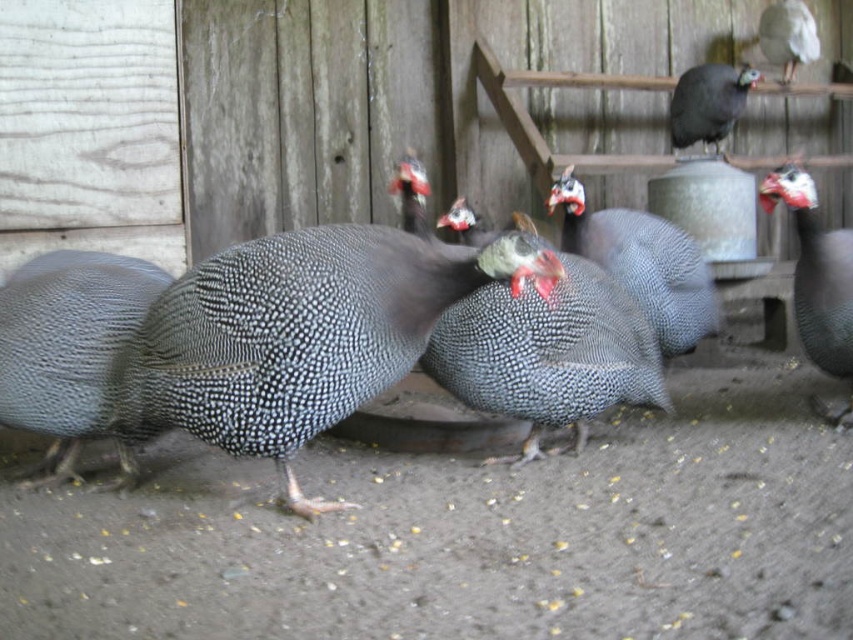
Who is positioned more to the right, speckled feathered guinea fowl at right or gray speckled guinea fowl at upper right?

From the viewer's perspective, gray speckled guinea fowl at upper right appears more on the right side.

Between point (839, 278) and point (720, 106), which one is positioned behind?

Point (720, 106)

At what (x,y) coordinates should I click in order to perform the action: click on speckled feathered guinea fowl at right. Please return your answer as a coordinate pair (x, y). Looking at the image, I should click on (816, 273).

Does speckled feathered guinea fowl at center have a greater height compared to white glossy bird at upper right?

Yes.

Which is in front, point (575, 246) or point (776, 35)?

Point (575, 246) is more forward.

Based on the photo, who is more forward, (x=577, y=211) or (x=782, y=36)?

Point (x=577, y=211)

Identify the location of speckled feathered guinea fowl at center. (643, 262).

Is pearlized gray guinea fowl at center below speckled feathered guinea fowl at right?

Correct, pearlized gray guinea fowl at center is located below speckled feathered guinea fowl at right.

Does pearlized gray guinea fowl at center have a greater height compared to speckled feathered guinea fowl at right?

Incorrect, pearlized gray guinea fowl at center's height is not larger of speckled feathered guinea fowl at right's.

Where is `pearlized gray guinea fowl at center`? pearlized gray guinea fowl at center is located at coordinates (547, 353).

At what (x,y) coordinates should I click in order to perform the action: click on pearlized gray guinea fowl at center. Please return your answer as a coordinate pair (x, y). Looking at the image, I should click on (547, 353).